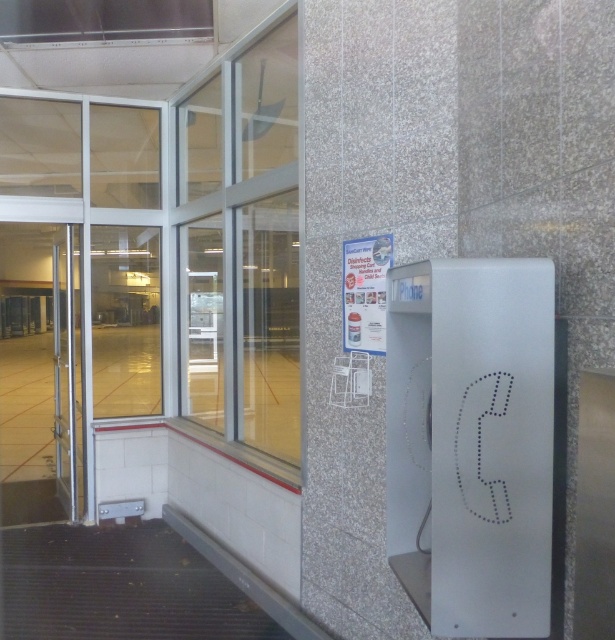
Question: Can you confirm if white plastic phone at right is positioned below clear glass door at left?

Choices:
 (A) no
 (B) yes

Answer: (B)

Question: Which point is farther from the camera taking this photo?

Choices:
 (A) (528, 524)
 (B) (62, 387)

Answer: (B)

Question: Which object is farther from the camera taking this photo?

Choices:
 (A) white plastic phone at right
 (B) clear glass door at left

Answer: (B)

Question: Is white plastic phone at right thinner than clear glass door at left?

Choices:
 (A) yes
 (B) no

Answer: (A)

Question: Which point is farther to the camera?

Choices:
 (A) white plastic phone at right
 (B) clear glass door at left

Answer: (B)

Question: Does white plastic phone at right have a larger size compared to clear glass door at left?

Choices:
 (A) no
 (B) yes

Answer: (A)